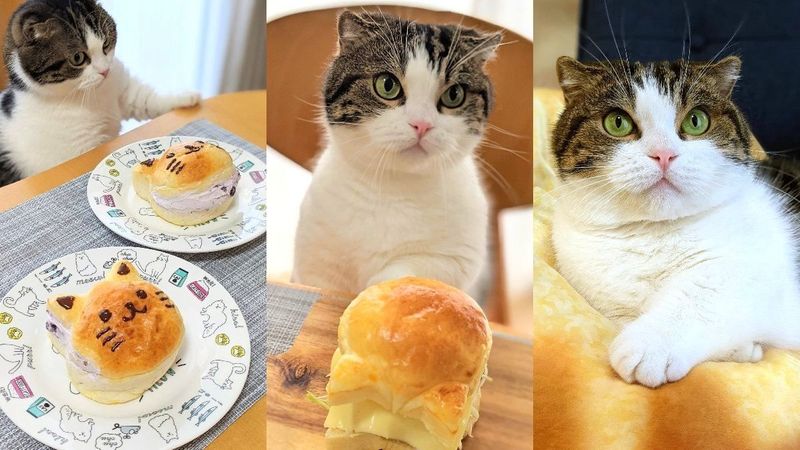
The height and width of the screenshot is (450, 800). I want to click on curtain, so click(196, 28), click(514, 22).